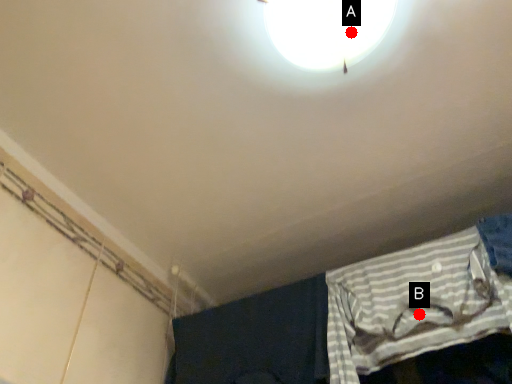
Question: Two points are circled on the image, labeled by A and B beside each circle. Among these points, which one is farthest from the camera?

Choices:
 (A) A is further
 (B) B is further

Answer: (B)